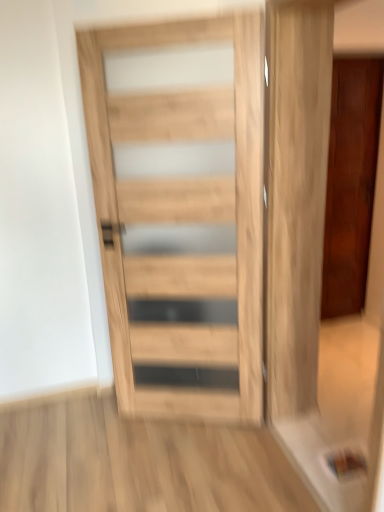
Image resolution: width=384 pixels, height=512 pixels. Find the location of `vacant space that is to the left of natural wood door at center, the 1th door from the front`. vacant space that is to the left of natural wood door at center, the 1th door from the front is located at coordinates (97, 440).